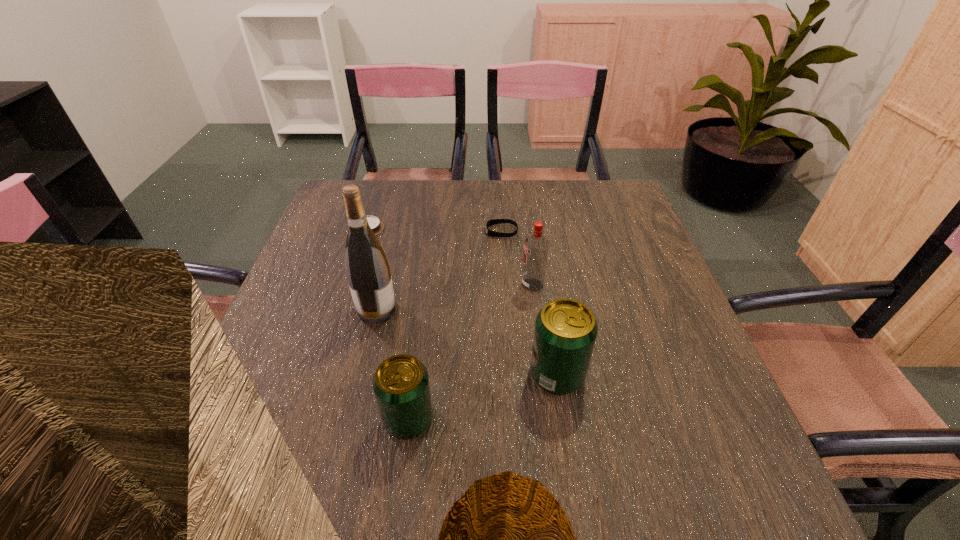
The height and width of the screenshot is (540, 960). What are the coordinates of `object positioned at the left edge` in the screenshot? It's located at (376, 225).

The image size is (960, 540). I want to click on object located in the far left corner section of the desktop, so click(376, 225).

What are the coordinates of `free space at the far edge` in the screenshot? It's located at click(458, 203).

The height and width of the screenshot is (540, 960). I want to click on free spot at the near edge of the desktop, so click(x=632, y=415).

What are the coordinates of `vacant point at the left edge` in the screenshot? It's located at (295, 288).

Identify the location of free spot at the right edge of the desktop. (640, 238).

Locate an element on the screen. The width and height of the screenshot is (960, 540). blank area at the far left corner is located at coordinates (344, 207).

Where is `vacant space at the near left corner`? Image resolution: width=960 pixels, height=540 pixels. vacant space at the near left corner is located at coordinates (268, 426).

Where is `vacant space in between the fourth nearest object and the shorter beer can`? vacant space in between the fourth nearest object and the shorter beer can is located at coordinates (470, 352).

The width and height of the screenshot is (960, 540). I want to click on unoccupied area between the vodka and the wristband, so click(x=516, y=258).